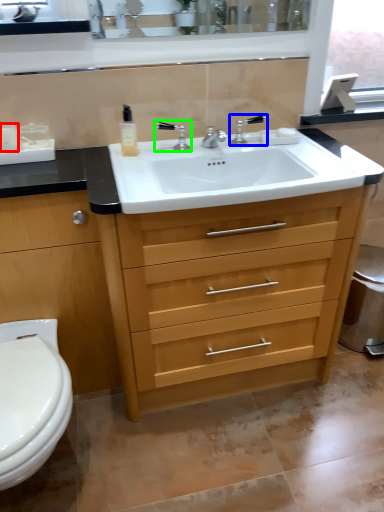
Question: Which object is the farthest from toiletry (highlighted by a red box)? Choose among these: tap (highlighted by a blue box) or tap (highlighted by a green box).

Choices:
 (A) tap
 (B) tap

Answer: (A)